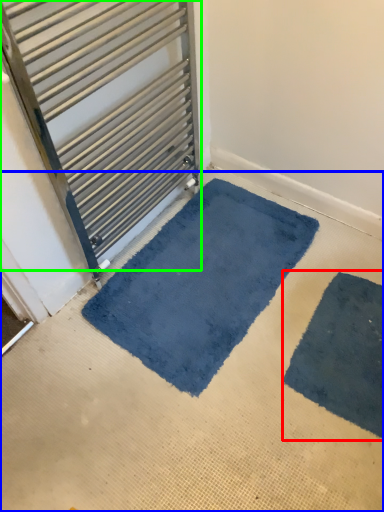
Question: Considering the real-world distances, which object is farthest from bath mat (highlighted by a red box)? concrete (highlighted by a blue box) or door (highlighted by a green box)?

Choices:
 (A) concrete
 (B) door

Answer: (B)